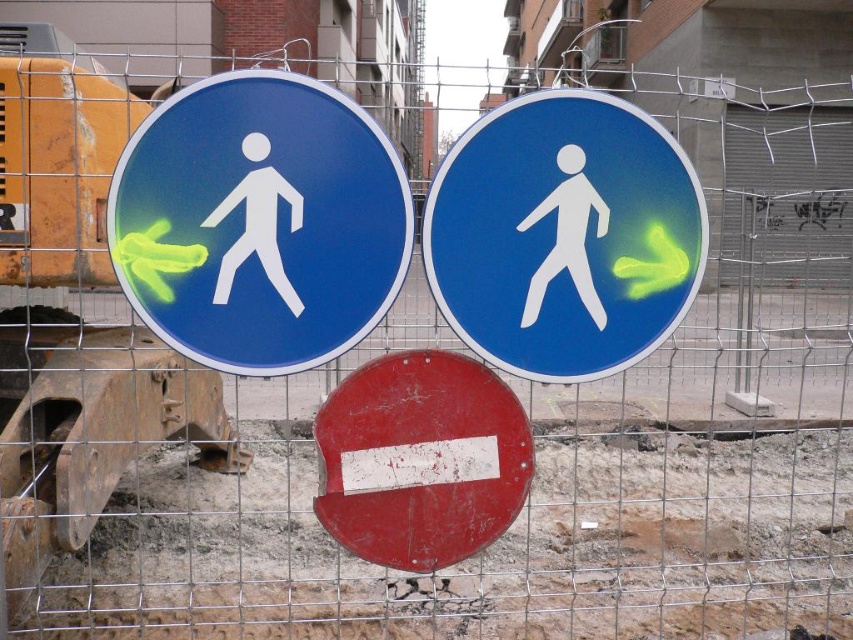
Can you confirm if blue glossy pedestrian sign at upper left is smaller than scratched red circle at center?

No, blue glossy pedestrian sign at upper left is not smaller than scratched red circle at center.

Who is lower down, blue glossy pedestrian sign at upper left or scratched red circle at center?

scratched red circle at center is below.

Describe the element at coordinates (259, 221) in the screenshot. This screenshot has height=640, width=853. I see `blue glossy pedestrian sign at upper left` at that location.

Locate an element on the screen. blue glossy pedestrian sign at upper left is located at coordinates (259, 221).

Between blue glossy pedestrian sign at center and scratched red circle at center, which one is positioned lower?

scratched red circle at center is below.

Consider the image. Which is above, blue glossy pedestrian sign at center or scratched red circle at center?

blue glossy pedestrian sign at center

Who is more forward, [543,316] or [369,422]?

Point [543,316] is more forward.

Where is `blue glossy pedestrian sign at center`? The width and height of the screenshot is (853, 640). blue glossy pedestrian sign at center is located at coordinates (564, 236).

Which is behind, point (344, 300) or point (494, 152)?

Positioned behind is point (494, 152).

Is blue glossy pedestrian sign at upper left below blue glossy pedestrian sign at center?

Incorrect, blue glossy pedestrian sign at upper left is not positioned below blue glossy pedestrian sign at center.

This screenshot has width=853, height=640. I want to click on blue glossy pedestrian sign at upper left, so click(259, 221).

Find the location of a particular element. Image resolution: width=853 pixels, height=640 pixels. blue glossy pedestrian sign at upper left is located at coordinates (259, 221).